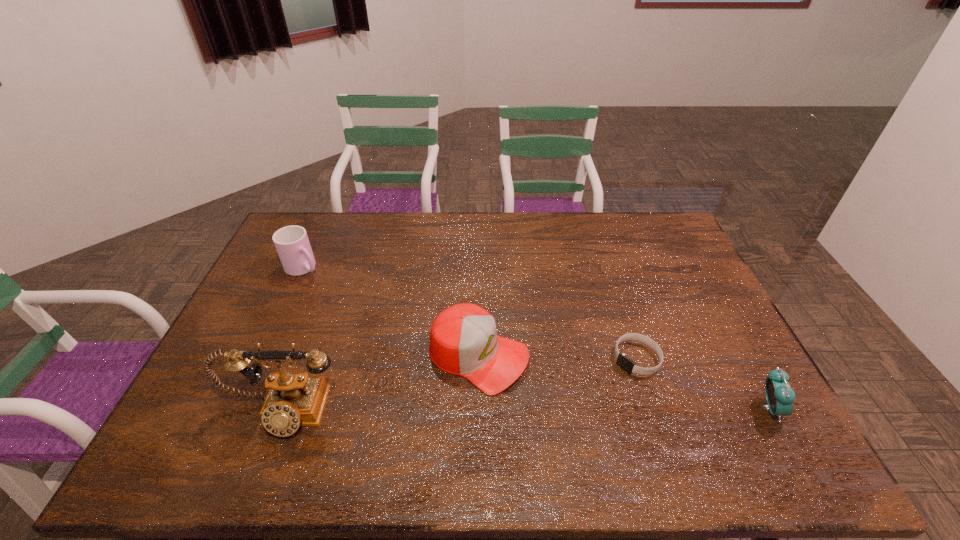
Find the location of a particular element. the tallest object is located at coordinates (295, 399).

You are a GUI agent. You are given a task and a screenshot of the screen. Output one action in this format:
    pyautogui.click(x=<x>, y=<y>)
    Task: Click on the rightmost object
    The width and height of the screenshot is (960, 540).
    Given the screenshot: What is the action you would take?
    pyautogui.click(x=780, y=397)

Identify the location of the farthest object. The height and width of the screenshot is (540, 960). (292, 244).

You are a GUI agent. You are given a task and a screenshot of the screen. Output one action in this format:
    pyautogui.click(x=<x>, y=<y>)
    Task: Click on the wristband
    This screenshot has width=960, height=540.
    Given the screenshot: What is the action you would take?
    pyautogui.click(x=626, y=363)

Identify the location of the shortest object. (626, 363).

I want to click on baseball cap, so click(463, 339).

Where is `free space located 0.210m with the handle on the side of the farthest object`? Image resolution: width=960 pixels, height=540 pixels. free space located 0.210m with the handle on the side of the farthest object is located at coordinates (354, 305).

The height and width of the screenshot is (540, 960). I want to click on vacant space situated 0.280m with the handle on the side of the farthest object, so click(x=369, y=315).

Find the location of `blank area located 0.180m with the handle on the side of the farthest object`. blank area located 0.180m with the handle on the side of the farthest object is located at coordinates (348, 300).

This screenshot has height=540, width=960. I want to click on free space located on the outer surface of the wristband, so coord(555,426).